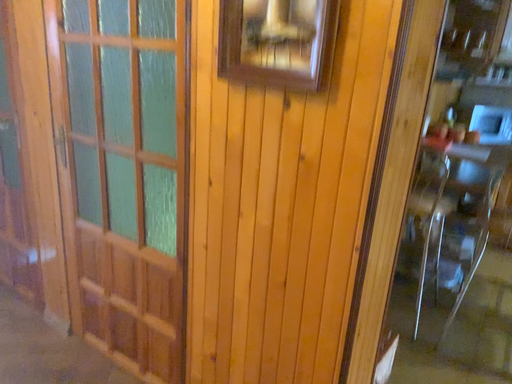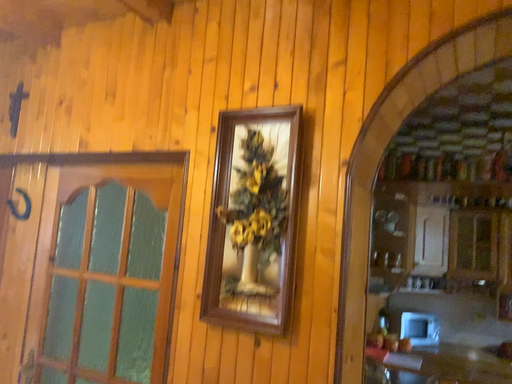
Question: How did the camera likely rotate when shooting the video?

Choices:
 (A) rotated upward
 (B) rotated downward

Answer: (A)